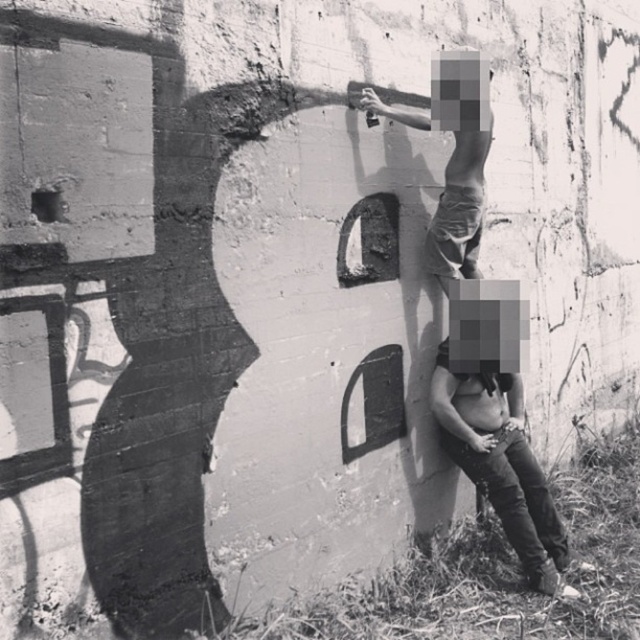
Can you confirm if smooth leather pants at lower right is bigger than matte black pants at upper center?

No, smooth leather pants at lower right is not bigger than matte black pants at upper center.

Is point (442, 364) closer to viewer compared to point (428, 116)?

That is False.

Locate an element on the screen. The height and width of the screenshot is (640, 640). smooth leather pants at lower right is located at coordinates (500, 461).